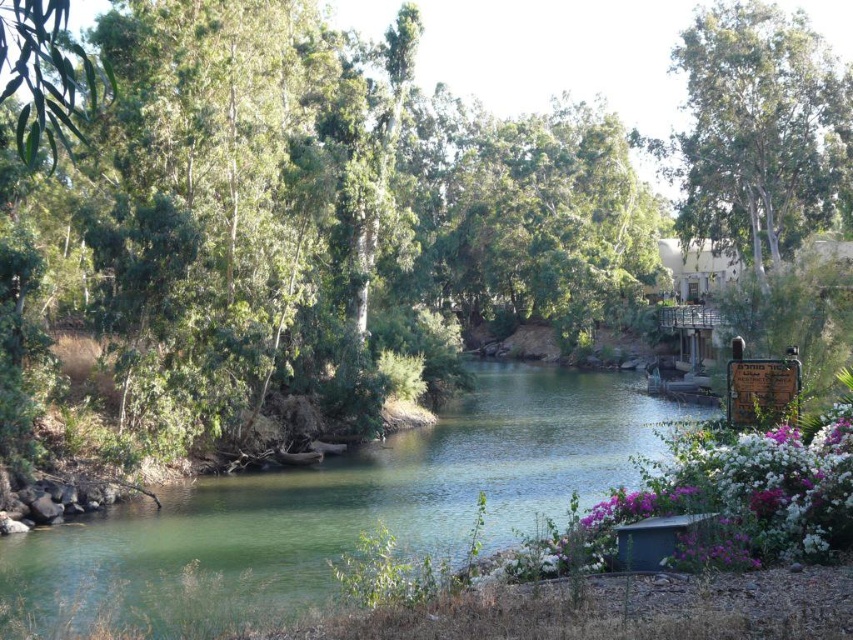
You are standing at the edge of the river and see the green leafy tree at center and the white matte flowers at lower right. Which object is closer to your right side?

The white matte flowers at lower right are closer to your right side since they are positioned to the right of the green leafy tree at center.

You are a photographer planning to capture a landscape shot of the scene. You want to include both the green smooth water at center and the white matte flowers at lower right in your frame. Which object should you focus on first to ensure both are in the shot?

The green smooth water at center is larger in size than the white matte flowers at lower right, so you should focus on the green smooth water at center first to ensure it fits properly in the frame before adjusting for the smaller white matte flowers at lower right.

You are standing at the center of the image and want to place a small sign exactly where the green leafy tree at center is. According to the coordinates provided, where should you place the sign?

The green leafy tree at center is located at point (285, 212), so you should place the sign at those coordinates.